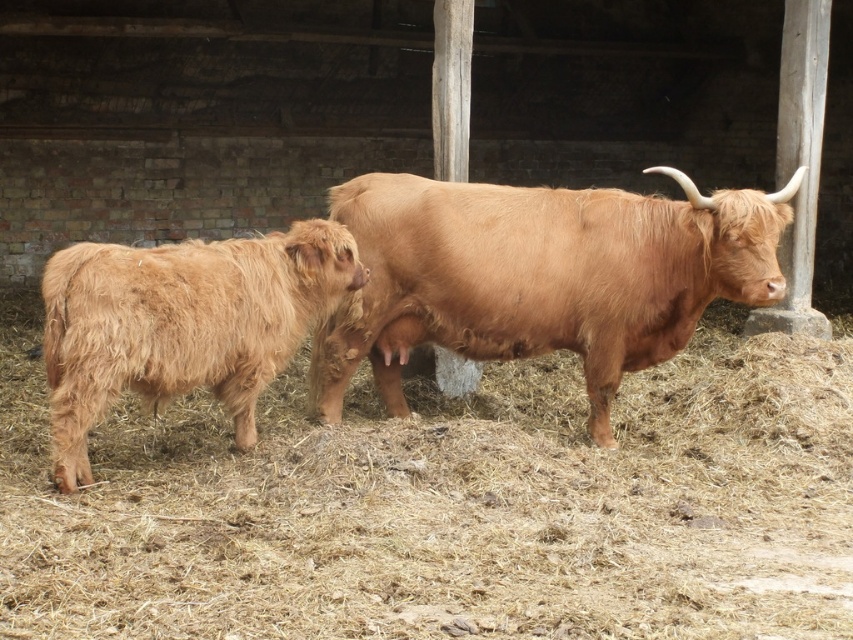
You are a farmer who wants to separate the brown woolly bull at center and the fuzzy brown yak at left into two stalls. The stalls are 90 centimeters apart. Can you fit both animals into the stalls without them touching each other?

The brown woolly bull at center and fuzzy brown yak at left are 90.01 centimeters apart from each other. Since the stalls are only 90 centimeters apart, there isn not enough space to prevent them from touching.

You are a farmer who needs to fit both the brown woolly bull at center and the fuzzy brown yak at left into a trailer that can only hold animals up to the size of the larger one. Can both animals fit in the trailer?

The brown woolly bull at center is bigger than the fuzzy brown yak at left, so the trailer can hold both animals since the yak is smaller and the bull is exactly the size the trailer can accommodate.

You are a farmer checking the barn. You see the brown woolly bull at center and the fuzzy brown yak at left. Which animal is positioned higher in the image?

The brown woolly bull at center is positioned higher than the fuzzy brown yak at left in the image.